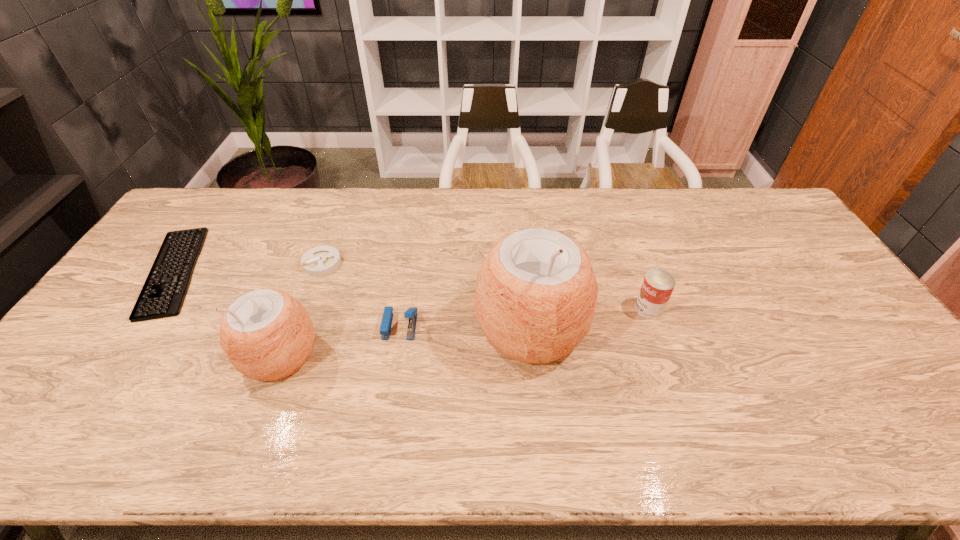
Where is `the shorter coconut`? the shorter coconut is located at coordinates (267, 334).

The width and height of the screenshot is (960, 540). What are the coordinates of `the left coconut` in the screenshot? It's located at (267, 334).

Image resolution: width=960 pixels, height=540 pixels. I want to click on the taller coconut, so click(536, 292).

At what (x,y) coordinates should I click in order to perform the action: click on the fifth object from left to right. Please return your answer as a coordinate pair (x, y). This screenshot has height=540, width=960. Looking at the image, I should click on pyautogui.click(x=536, y=292).

Identify the location of computer keyboard. Image resolution: width=960 pixels, height=540 pixels. (164, 298).

Find the location of `the leftmost object`. the leftmost object is located at coordinates (164, 298).

Find the location of `ashtray`. ashtray is located at coordinates (322, 260).

This screenshot has width=960, height=540. I want to click on stapler, so click(386, 323).

Locate an element on the screen. the fourth object from left to right is located at coordinates (386, 323).

Where is `the rightmost object`? the rightmost object is located at coordinates (658, 285).